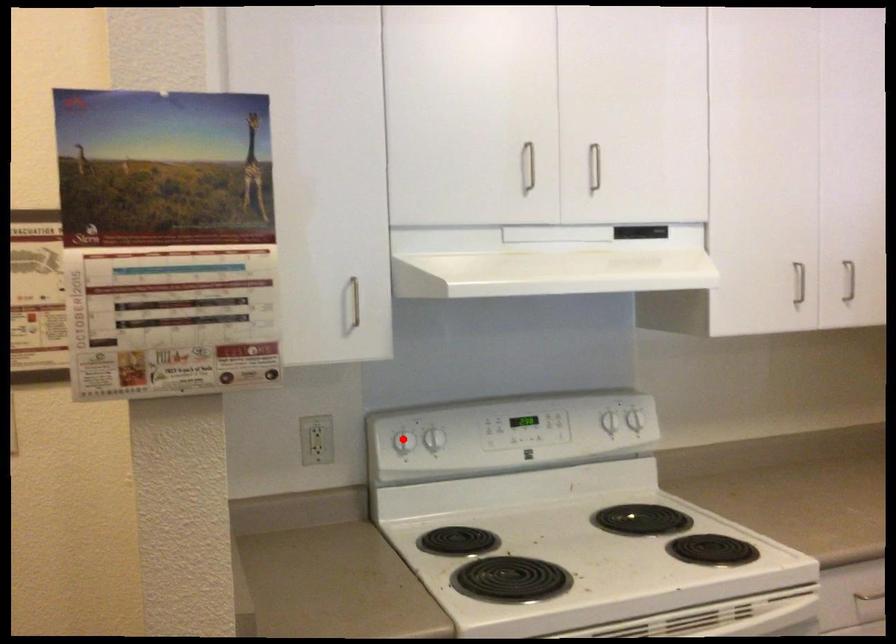
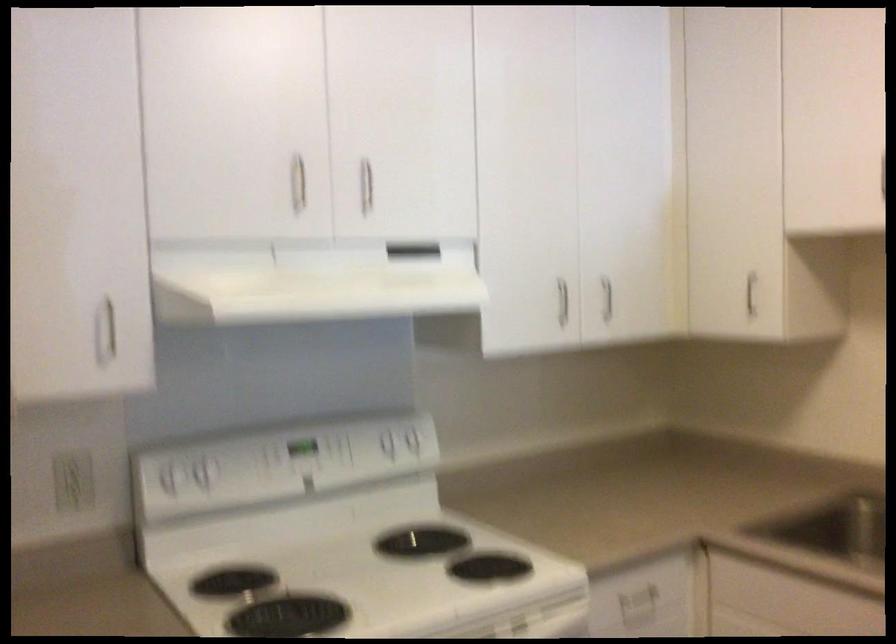
Locate, in the second image, the point that corresponds to the highlighted location in the first image.

(169, 476)